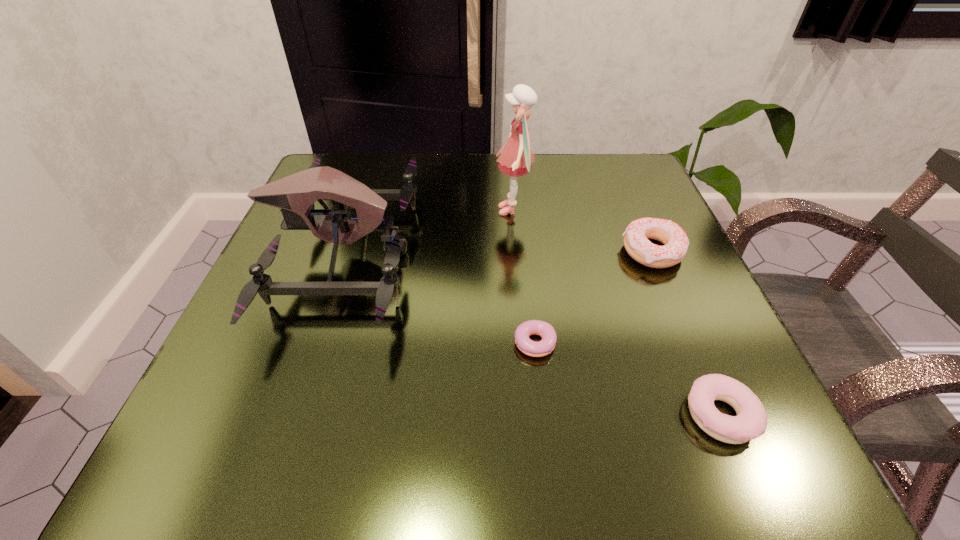
At what (x,y) coordinates should I click in order to perform the action: click on object at the far left corner. Please return your answer as a coordinate pair (x, y). Looking at the image, I should click on (295, 194).

Find the location of a particular element. object present at the near right corner is located at coordinates (751, 421).

Locate an element on the screen. vacant space at the far edge of the desktop is located at coordinates (546, 172).

In the image, there is a desktop. At what (x,y) coordinates should I click in order to perform the action: click on free space at the near edge. Please return your answer as a coordinate pair (x, y). The image size is (960, 540). Looking at the image, I should click on (351, 455).

Locate an element on the screen. This screenshot has height=540, width=960. free space at the left edge of the desktop is located at coordinates (278, 253).

The height and width of the screenshot is (540, 960). In the image, there is a desktop. What are the coordinates of `vacant space at the right edge` in the screenshot? It's located at (694, 332).

Find the location of `vacant region at the far right corner of the desktop`. vacant region at the far right corner of the desktop is located at coordinates (631, 156).

What are the coordinates of `free space between the leftmost object and the shortest doughnut` in the screenshot? It's located at (439, 300).

Identify the location of free area in between the shortest doughnut and the leftmost object. (439, 300).

The image size is (960, 540). In order to click on empty space that is in between the drone and the doll in this screenshot , I will do `click(428, 232)`.